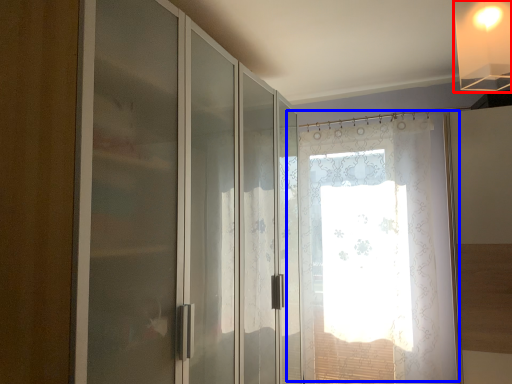
Question: Which object is further to the camera taking this photo, light fixture (highlighted by a red box) or window (highlighted by a blue box)?

Choices:
 (A) light fixture
 (B) window

Answer: (B)